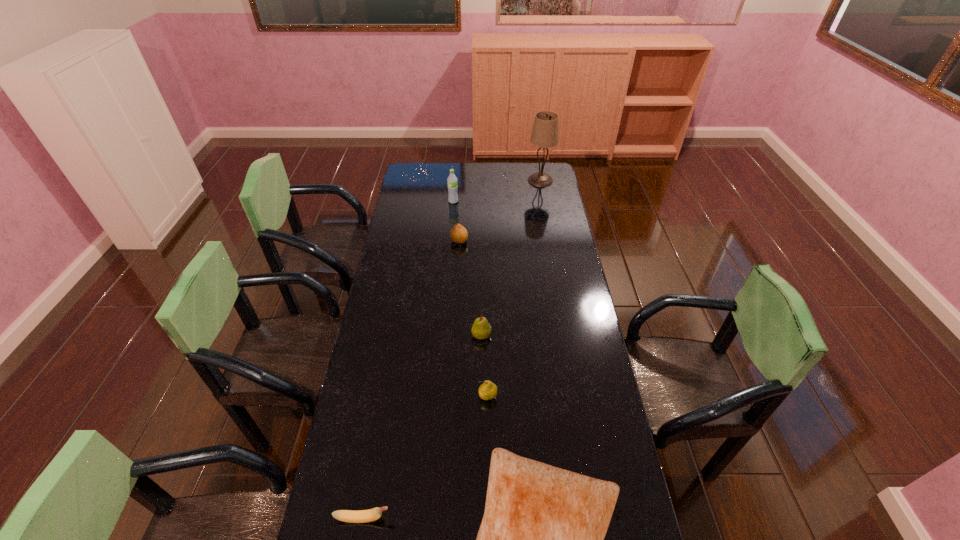
You are a GUI agent. You are given a task and a screenshot of the screen. Output one action in this format:
    pyautogui.click(x=<x>, y=<y>)
    Task: Click on the vacant space that is in between the tallest object and the banana
    This screenshot has height=540, width=960.
    Given the screenshot: What is the action you would take?
    pyautogui.click(x=452, y=349)

Where is `free point between the farthest object and the banana`? The width and height of the screenshot is (960, 540). free point between the farthest object and the banana is located at coordinates (452, 349).

The image size is (960, 540). What are the coordinates of `free space between the farthest object and the fifth farthest object` in the screenshot? It's located at (514, 289).

Image resolution: width=960 pixels, height=540 pixels. Identify the location of free space between the second farthest object and the banana. (408, 360).

At what (x,y) coordinates should I click in order to perform the action: click on the closest object to the bread. Please return your answer as a coordinate pair (x, y). The width and height of the screenshot is (960, 540). Looking at the image, I should click on (488, 390).

Identify which object is the third nearest to the banana. Please provide its 2D coordinates. Your answer should be formatted as a tuple, i.e. [(x, y)], where the tuple contains the x and y coordinates of a point satisfying the conditions above.

[(481, 329)]

Identify which pear is located as the nearest to the banana. Please provide its 2D coordinates. Your answer should be formatted as a tuple, i.e. [(x, y)], where the tuple contains the x and y coordinates of a point satisfying the conditions above.

[(488, 390)]

The image size is (960, 540). I want to click on pear that is the third closest to the water bottle, so pos(488,390).

Identify the location of vacant space that satisfies the following two spatial constraints: 1. on the front side of the water bottle; 2. on the right side of the third farthest object. The width and height of the screenshot is (960, 540). (450, 241).